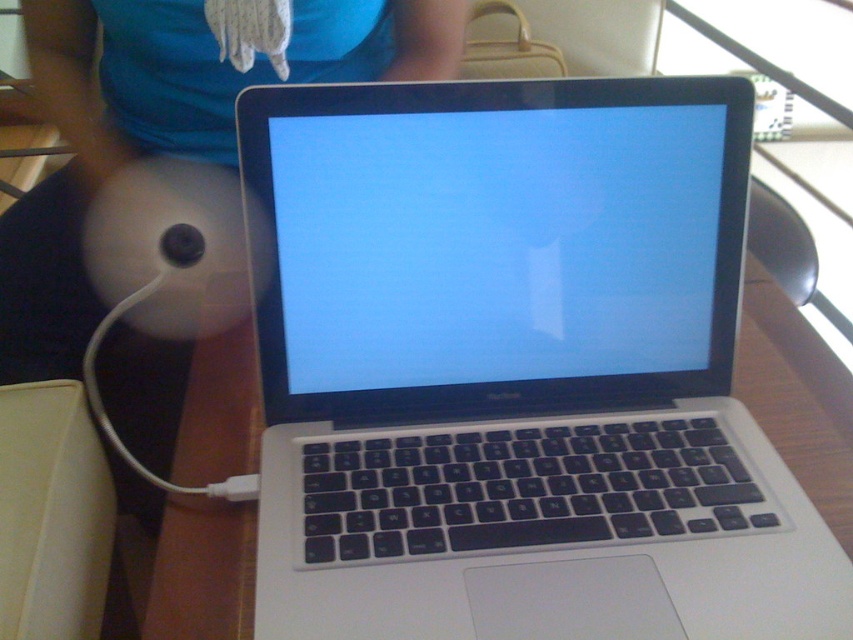
Which is above, matte plastic screen at center or matte white plush at center?

matte white plush at center is higher up.

Which is in front, point (277, 147) or point (96, 310)?

Point (277, 147)

Locate an element on the screen. matte plastic screen at center is located at coordinates (496, 248).

Between silver metallic laptop at center and matte white plush at center, which one is positioned lower?

silver metallic laptop at center is lower down.

Who is taller, silver metallic laptop at center or matte white plush at center?

Standing taller between the two is matte white plush at center.

This screenshot has width=853, height=640. What are the coordinates of `silver metallic laptop at center` in the screenshot? It's located at (517, 371).

Can you confirm if silver metallic laptop at center is shorter than matte plastic screen at center?

No.

Is silver metallic laptop at center to the left of matte plastic screen at center from the viewer's perspective?

No, silver metallic laptop at center is not to the left of matte plastic screen at center.

Is point (407, 515) closer to viewer compared to point (697, 301)?

Yes, it is in front of point (697, 301).

Image resolution: width=853 pixels, height=640 pixels. I want to click on silver metallic laptop at center, so click(x=517, y=371).